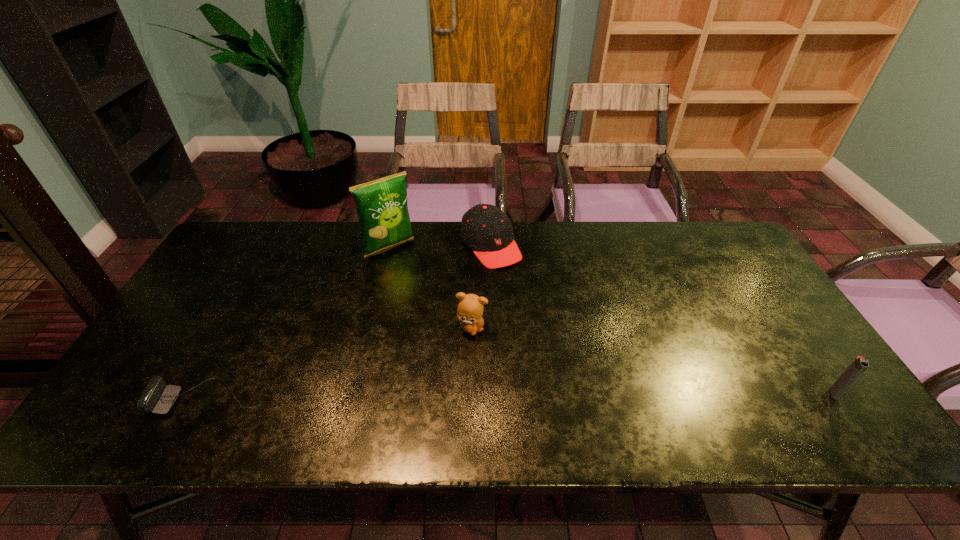
I want to click on vacant spot on the desktop that is between the webcam and the rightmost object and is positioned on the face of the teddy bear, so click(x=534, y=396).

The height and width of the screenshot is (540, 960). Find the location of `free space on the desktop that is between the webcam and the igniter and is positioned on the front-facing side of the cap`. free space on the desktop that is between the webcam and the igniter and is positioned on the front-facing side of the cap is located at coordinates (610, 395).

This screenshot has height=540, width=960. Identify the location of free space on the desktop that is between the webcam and the igniter and is positioned on the front-facing side of the second object from left to right. (516, 396).